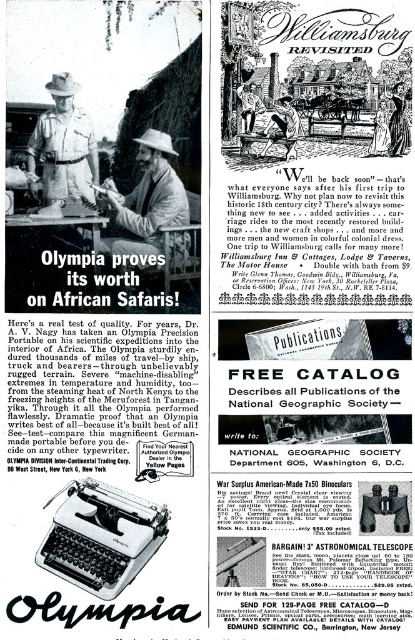
Question: In this image, where is khaki cotton hat at center located relative to khaki uniform at center?

Choices:
 (A) left
 (B) right

Answer: (B)

Question: Which of the following is the closest to the observer?

Choices:
 (A) (60, 108)
 (B) (136, 228)

Answer: (A)

Question: Which object appears closest to the camera in this image?

Choices:
 (A) khaki uniform at center
 (B) khaki cotton hat at center

Answer: (A)

Question: In this image, where is khaki cotton hat at center located relative to khaki uniform at center?

Choices:
 (A) right
 (B) left

Answer: (A)

Question: Can you confirm if khaki cotton hat at center is bigger than khaki uniform at center?

Choices:
 (A) yes
 (B) no

Answer: (A)